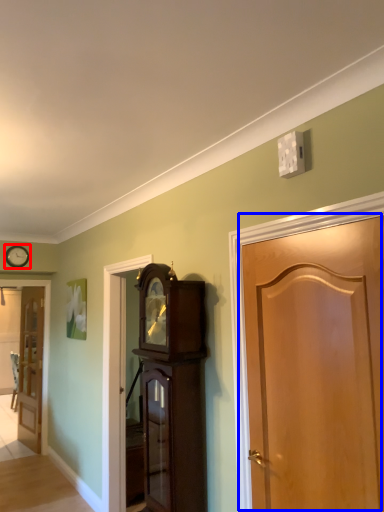
Question: Which of the following is the farthest to the observer, clock (highlighted by a red box) or door (highlighted by a blue box)?

Choices:
 (A) clock
 (B) door

Answer: (A)